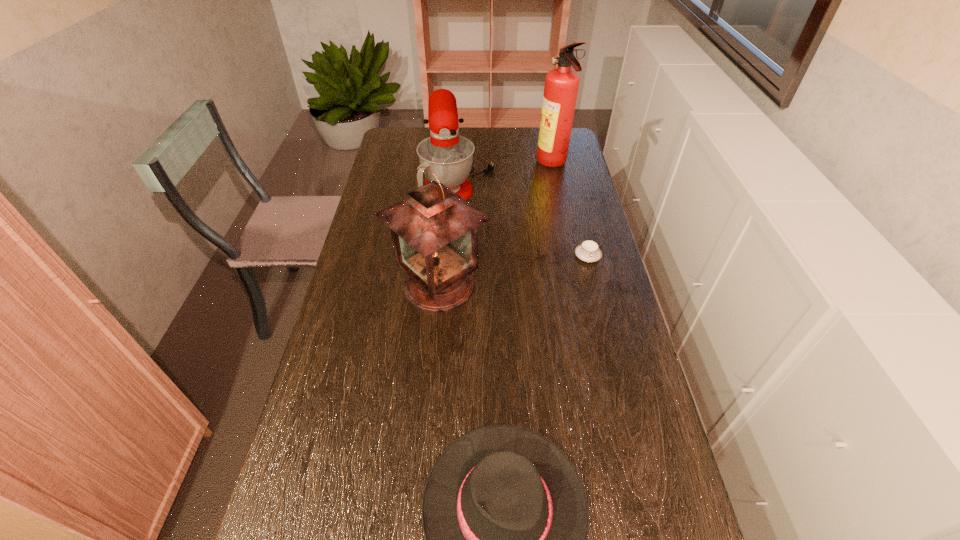
You are a GUI agent. You are given a task and a screenshot of the screen. Output one action in this format:
    pyautogui.click(x=<x>, y=<y>)
    Task: Click on the tallest object
    Image resolution: width=960 pixels, height=540 pixels.
    Given the screenshot: What is the action you would take?
    pyautogui.click(x=561, y=86)

You are a GUI agent. You are given a task and a screenshot of the screen. Output one action in this format:
    pyautogui.click(x=<x>, y=<y>)
    Task: Click on the oil lamp
    
    Given the screenshot: What is the action you would take?
    pyautogui.click(x=435, y=231)

Find the location of a particular element. The image size is (960, 540). the third tallest object is located at coordinates (449, 156).

You are a GUI agent. You are given a task and a screenshot of the screen. Output one action in this format:
    pyautogui.click(x=<x>, y=<y>)
    Task: Click on the teacup
    Image resolution: width=960 pixels, height=540 pixels.
    Given the screenshot: What is the action you would take?
    pyautogui.click(x=588, y=251)

Find the location of a particular element. The height and width of the screenshot is (540, 960). vacant space located 0.370m on the front-facing side of the fire extinguisher is located at coordinates (444, 164).

I want to click on free region located 0.060m on the front-facing side of the fire extinguisher, so click(521, 164).

Image resolution: width=960 pixels, height=540 pixels. What are the coordinates of `vacant area located on the front-facing side of the fire extinguisher` in the screenshot? It's located at (451, 164).

You are a GUI agent. You are given a task and a screenshot of the screen. Output one action in this format:
    pyautogui.click(x=<x>, y=<y>)
    Task: Click on the vacant space located on the front of the oil lamp
    
    Given the screenshot: What is the action you would take?
    pyautogui.click(x=423, y=465)

Locate an element on the screen. Image resolution: width=960 pixels, height=540 pixels. vacant space situated 0.160m on the bowl side of the mixer is located at coordinates (536, 174).

You are a GUI agent. You are given a task and a screenshot of the screen. Output one action in this format:
    pyautogui.click(x=<x>, y=<y>)
    Task: Click on the vacant space located on the side with the handle of the shortest object
    The width and height of the screenshot is (960, 540).
    Given the screenshot: What is the action you would take?
    pyautogui.click(x=593, y=280)